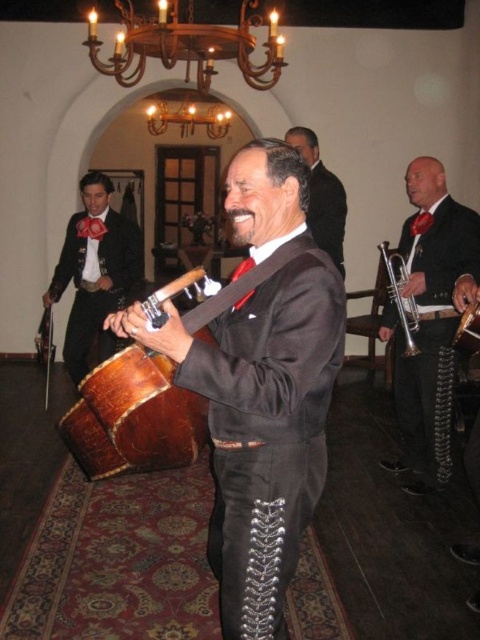
You are planning to place a decorative banner between the shiny black suit at left and the black satin tie at center. The banner is 8 feet long. Will it fit perfectly between them without overlapping either object?

The shiny black suit at left and the black satin tie at center are 8.18 feet apart. Since the banner is 8 feet long, it will fit between them with a small gap of 0.18 feet remaining.

You are a performer in a mariachi band and need to move from the matte black trumpet at center to the wooden drum at center during a performance. Given that your average step length is 0.7 meters, how many steps will it take you to reach the drum?

The distance between the matte black trumpet at center and the wooden drum at center is 1.77 meters. With each step being 0.7 meters, dividing 1.77 by 0.7 gives approximately 2.53 steps. Since you can only take whole steps, it would take 3 steps to reach the drum.